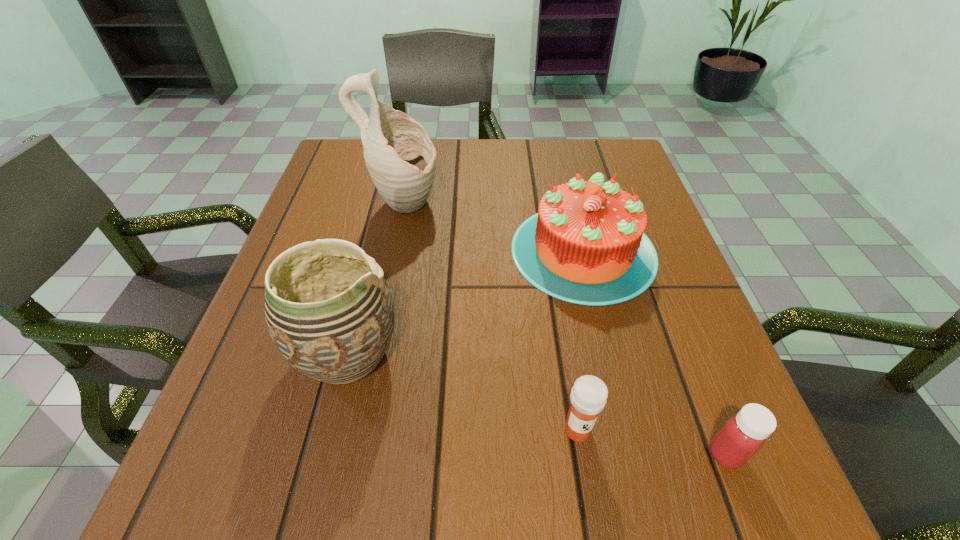
Where is `free point located 0.050m on the left of the right medicine`? Image resolution: width=960 pixels, height=540 pixels. free point located 0.050m on the left of the right medicine is located at coordinates [673, 454].

Locate an element on the screen. The image size is (960, 540). object positioned at the far edge is located at coordinates (401, 159).

You are a GUI agent. You are given a task and a screenshot of the screen. Output one action in this format:
    pyautogui.click(x=<x>, y=<y>)
    Task: Click on the object present at the near edge
    This screenshot has height=540, width=960.
    Given the screenshot: What is the action you would take?
    pyautogui.click(x=743, y=435)

In order to click on pitcher located at the left edge in this screenshot , I will do `click(401, 159)`.

Where is `pottery positioned at the left edge`? This screenshot has height=540, width=960. pottery positioned at the left edge is located at coordinates (330, 314).

You are a GUI agent. You are given a task and a screenshot of the screen. Output one action in this format:
    pyautogui.click(x=<x>, y=<y>)
    Task: Click on the cake at the right edge
    Image resolution: width=960 pixels, height=540 pixels.
    Given the screenshot: What is the action you would take?
    pyautogui.click(x=586, y=245)

Where is `medicine that is at the right edge`? The width and height of the screenshot is (960, 540). medicine that is at the right edge is located at coordinates [x=743, y=435].

I want to click on object present at the far left corner, so click(x=401, y=159).

Identify the location of object positioned at the near right corner. (743, 435).

This screenshot has width=960, height=540. In the image, there is a desktop. In order to click on vacant region at the far edge in this screenshot , I will do `click(444, 185)`.